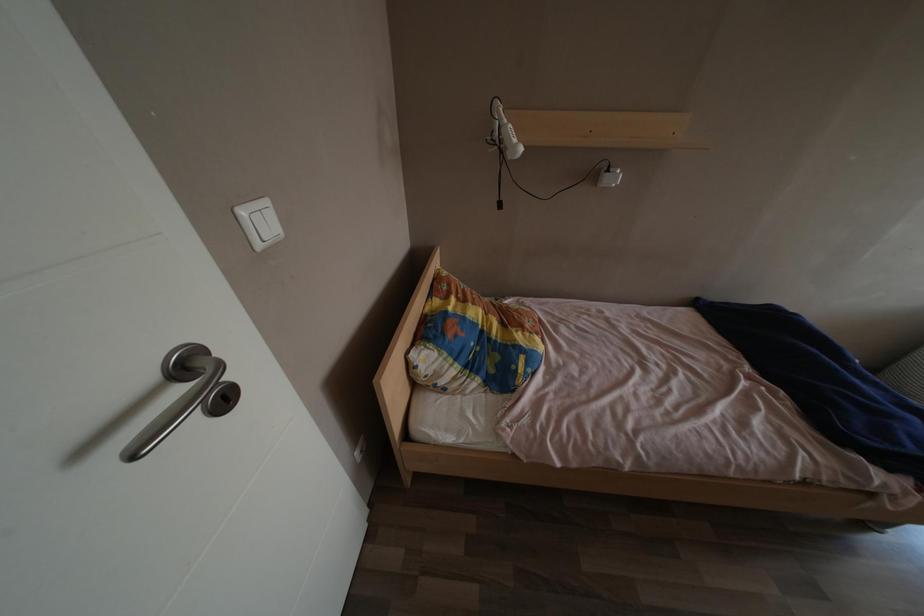
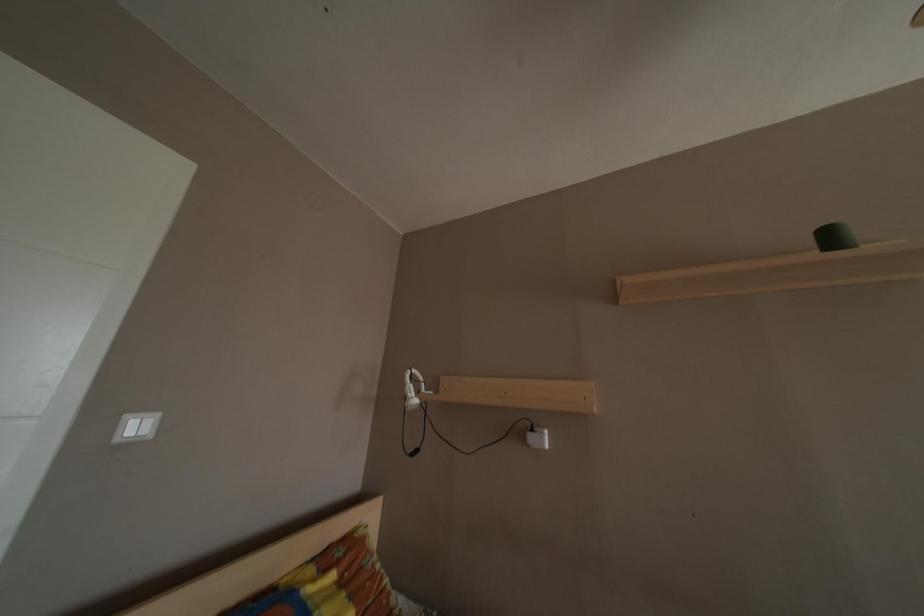
The first image is from the beginning of the video and the second image is from the end. How did the camera likely rotate when shooting the video?

The rotation direction of the camera is left-up.